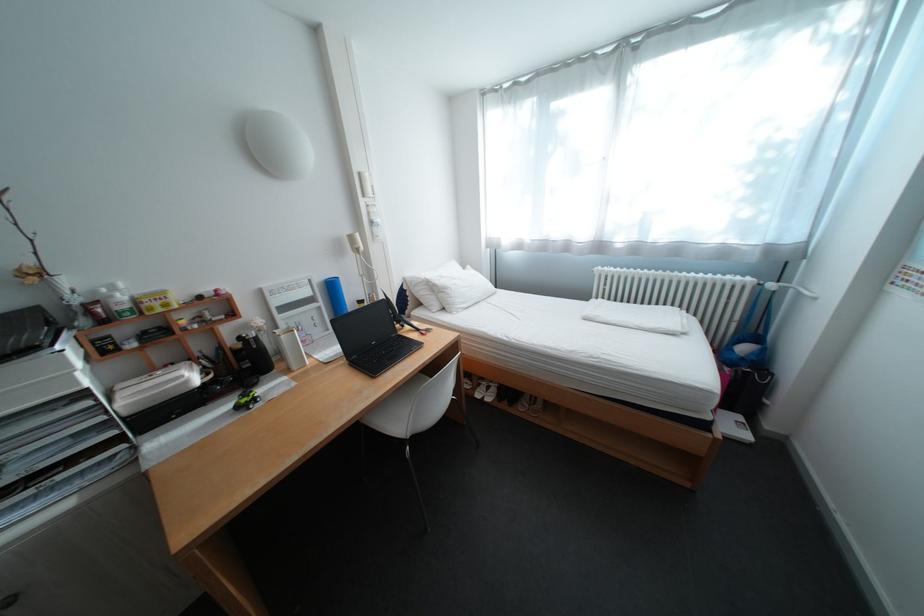
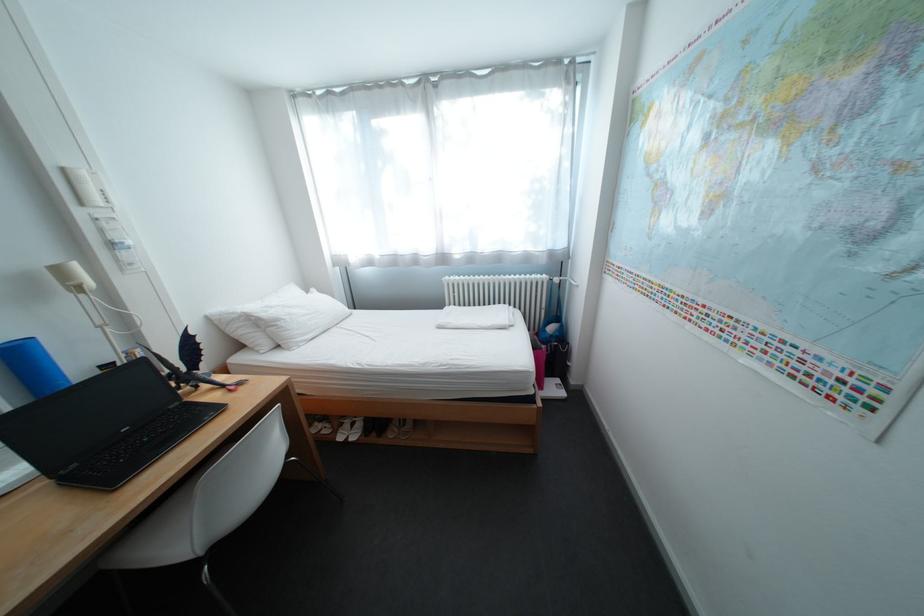
Question: The images are taken continuously from a first-person perspective. In which direction is your viewpoint rotating?

Choices:
 (A) Left
 (B) Right
 (C) Up
 (D) Down

Answer: (B)